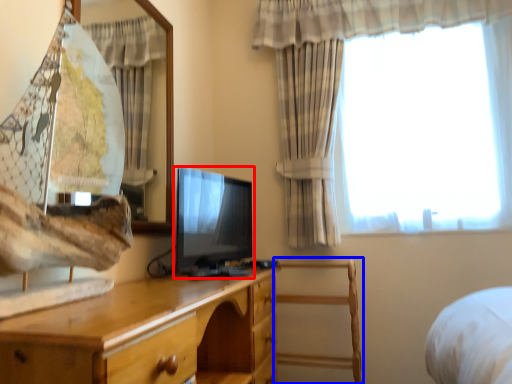
Question: Which object appears closest to the camera in this image, television (highlighted by a red box) or chair (highlighted by a blue box)?

Choices:
 (A) television
 (B) chair

Answer: (A)